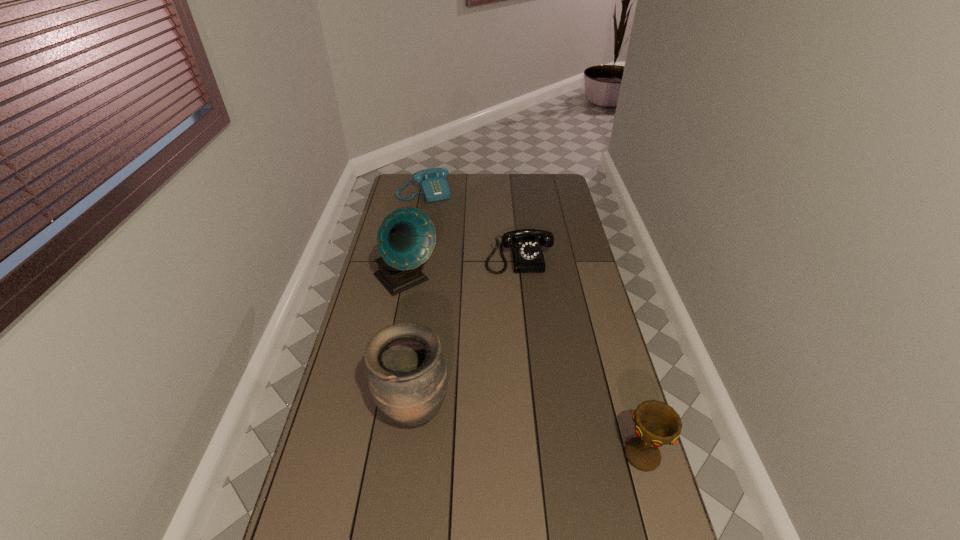
Where is `urn`? The image size is (960, 540). urn is located at coordinates (407, 375).

The width and height of the screenshot is (960, 540). I want to click on chalice, so click(656, 423).

You are a GUI agent. You are given a task and a screenshot of the screen. Output one action in this format:
    pyautogui.click(x=<x>, y=<y>)
    Task: Click on the third tallest object
    The height and width of the screenshot is (540, 960).
    Given the screenshot: What is the action you would take?
    pyautogui.click(x=656, y=423)

Image resolution: width=960 pixels, height=540 pixels. Identify the location of the fourth object from left to right. (525, 245).

The height and width of the screenshot is (540, 960). I want to click on the fourth tallest object, so click(x=525, y=245).

Identify the location of the left telephone. The height and width of the screenshot is (540, 960). (432, 182).

At what (x,y) coordinates should I click in order to perform the action: click on the shortest object. Please return your answer as a coordinate pair (x, y). Looking at the image, I should click on (432, 182).

At what (x,y) coordinates should I click in order to perform the action: click on phonograph_record. Please return your answer as a coordinate pair (x, y). Image resolution: width=960 pixels, height=540 pixels. Looking at the image, I should click on (406, 238).

Locate an element on the screen. The height and width of the screenshot is (540, 960). vacant space located on the back of the second tallest object is located at coordinates (425, 332).

Identify the location of vacant space located 0.390m on the left of the rightmost object. The height and width of the screenshot is (540, 960). (480, 455).